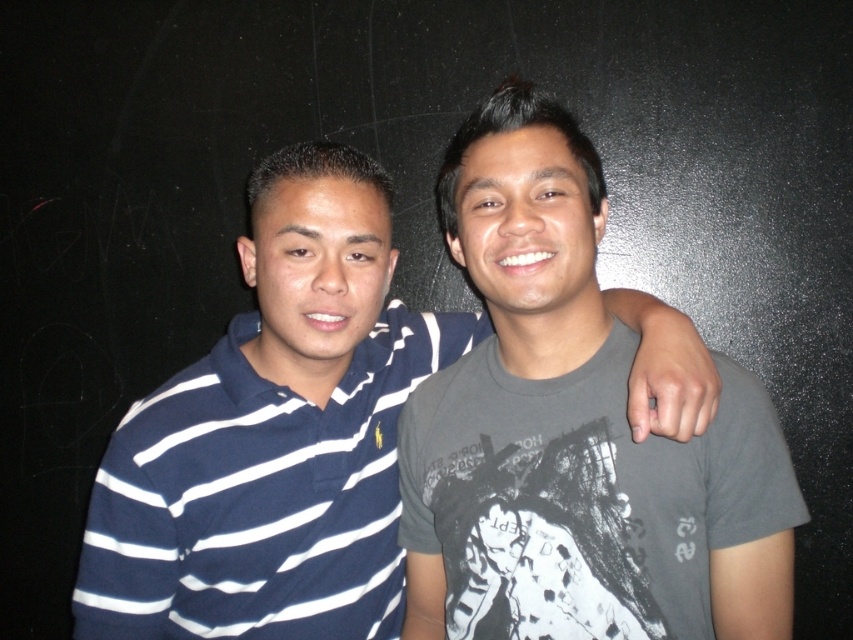
How far apart are gray matte t-shirt at center and blue striped polo shirt at left?

They are 22.16 centimeters apart.

Measure the distance between point (x=590, y=152) and camera.

They are 3.43 feet apart.

Based on the photo, who is more forward, [654,611] or [287,616]?

Point [654,611]

Locate an element on the screen. The width and height of the screenshot is (853, 640). gray matte t-shirt at center is located at coordinates 573,433.